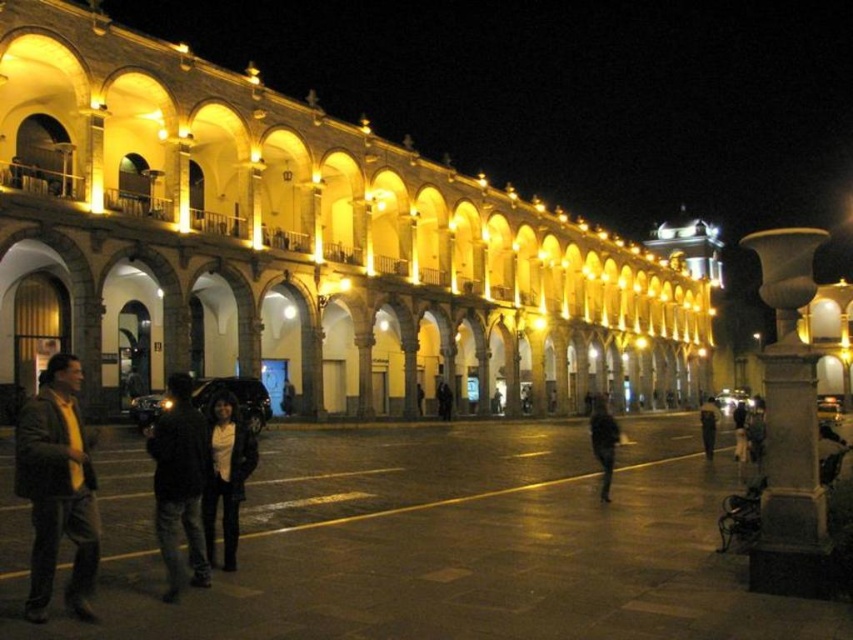
You are standing in the plaza and see two points marked in the image. The first point is at coordinates point (177, 442) and the second is at point (602, 400). Which point is closer to you?

Point (177, 442) is in front of point (602, 400), so it is closer to you.

You are a photographer trying to capture a candid shot of the two people in the scene. The person wearing the dark blue jeans at center and the person in the dark brown leather jacket at center are standing close to each other. If you want to frame the jeans first in your shot, which direction should you move your camera?

The dark blue jeans at center is positioned on the left side of the dark brown leather jacket at center, so to frame the jeans first, you should move your camera to the left.

You are standing in the plaza and want to take a photo of both the decorative column and the grand building. The decorative column is located at point (74, 456) and the grand building is at point (595, 451). Since both points are in the frame, will the decorative column appear larger in the photo compared to the grand building?

Yes, the decorative column at point (74, 456) will appear larger in the photo than the grand building at point (595, 451) because it is closer to the camera.